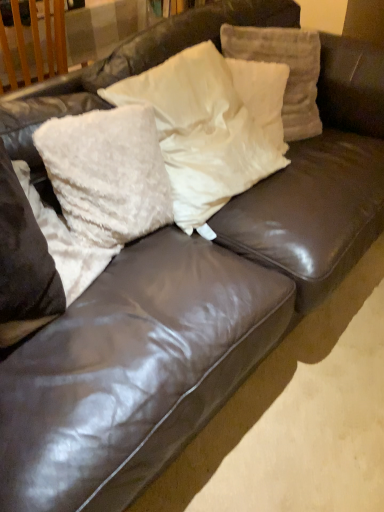
Question: Based on their positions, is white fluffy pillow at center, arranged as the 2th pillow when viewed from the left, located to the left or right of white fluffy pillow at left, which is the first pillow from left to right?

Choices:
 (A) right
 (B) left

Answer: (A)

Question: In terms of width, does white fluffy pillow at center, arranged as the 2th pillow when viewed from the left, look wider or thinner when compared to white fluffy pillow at left, which is the first pillow from left to right?

Choices:
 (A) thin
 (B) wide

Answer: (A)

Question: Which object is positioned closest to the white fluffy pillow at center, marked as the 3th pillow in a right-to-left arrangement?

Choices:
 (A) white fluffy pillow at upper center, positioned as the fourth pillow in left-to-right order
 (B) white fluffy pillow at upper center, the 1th pillow positioned from the right
 (C) white fluffy pillow at left, arranged as the fifth pillow when viewed from the right
 (D) white fluffy pillow at center, marked as the 4th pillow in a right-to-left arrangement

Answer: (A)

Question: Which of these objects is positioned farthest from the white fluffy pillow at upper center, which is the fifth pillow in left-to-right order?

Choices:
 (A) white fluffy pillow at center, marked as the 3th pillow in a right-to-left arrangement
 (B) white fluffy pillow at center, marked as the 4th pillow in a right-to-left arrangement
 (C) white fluffy pillow at upper center, arranged as the 2th pillow when viewed from the right
 (D) white fluffy pillow at left, arranged as the fifth pillow when viewed from the right

Answer: (D)